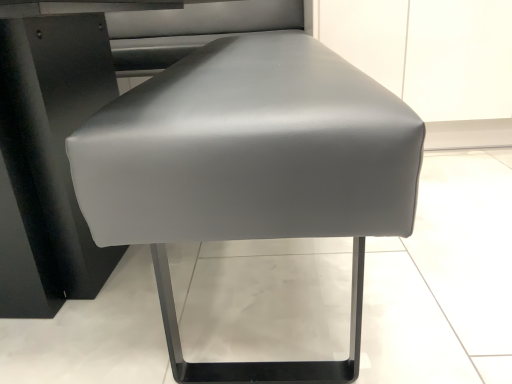
This screenshot has width=512, height=384. Find the location of `matte gray cushion at center`. matte gray cushion at center is located at coordinates (251, 170).

Describe the element at coordinates (251, 170) in the screenshot. I see `matte gray cushion at center` at that location.

Identify the location of matte gray cushion at center. The width and height of the screenshot is (512, 384). (251, 170).